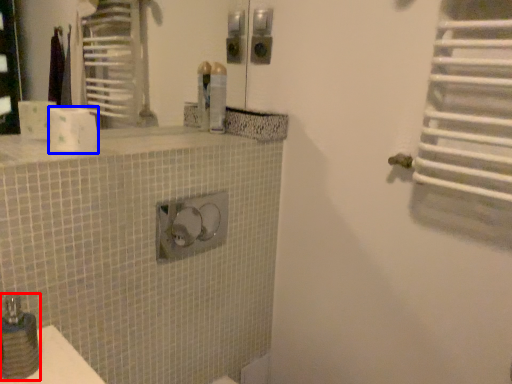
Question: Which object appears farthest to the camera in this image, soap dispenser (highlighted by a red box) or toilet paper (highlighted by a blue box)?

Choices:
 (A) soap dispenser
 (B) toilet paper

Answer: (B)